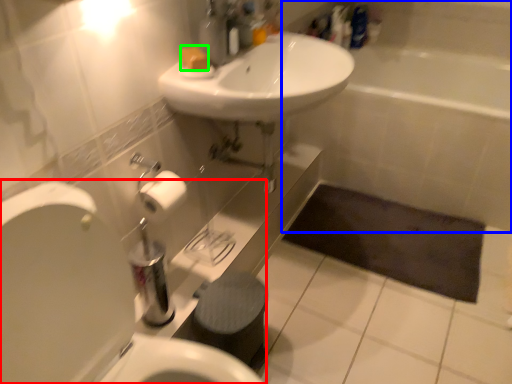
Question: Based on their relative distances, which object is nearer to toilet (highlighted by a red box)? Choose from bath (highlighted by a blue box) and soap (highlighted by a green box).

Choices:
 (A) bath
 (B) soap

Answer: (B)